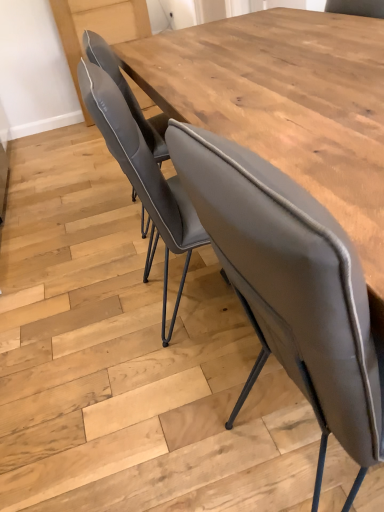
Question: Considering the positions of matte gray chair at center and wooden table at center in the image, is matte gray chair at center bigger or smaller than wooden table at center?

Choices:
 (A) big
 (B) small

Answer: (A)

Question: From the image's perspective, is matte gray chair at center located above or below wooden table at center?

Choices:
 (A) above
 (B) below

Answer: (B)

Question: From a real-world perspective, relative to wooden table at center, is matte gray chair at center vertically above or below?

Choices:
 (A) above
 (B) below

Answer: (A)

Question: In terms of size, does wooden table at center appear bigger or smaller than matte gray chair at center?

Choices:
 (A) big
 (B) small

Answer: (B)

Question: Considering the positions of wooden table at center and matte gray chair at center in the image, is wooden table at center wider or thinner than matte gray chair at center?

Choices:
 (A) wide
 (B) thin

Answer: (B)

Question: Is wooden table at center taller or shorter than matte gray chair at center?

Choices:
 (A) short
 (B) tall

Answer: (A)

Question: From the image's perspective, is wooden table at center positioned above or below matte gray chair at center?

Choices:
 (A) above
 (B) below

Answer: (A)